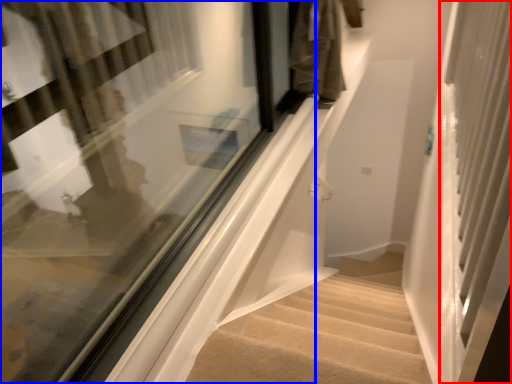
Question: Which object appears farthest to the camera in this image, screen door (highlighted by a red box) or window (highlighted by a blue box)?

Choices:
 (A) screen door
 (B) window

Answer: (B)